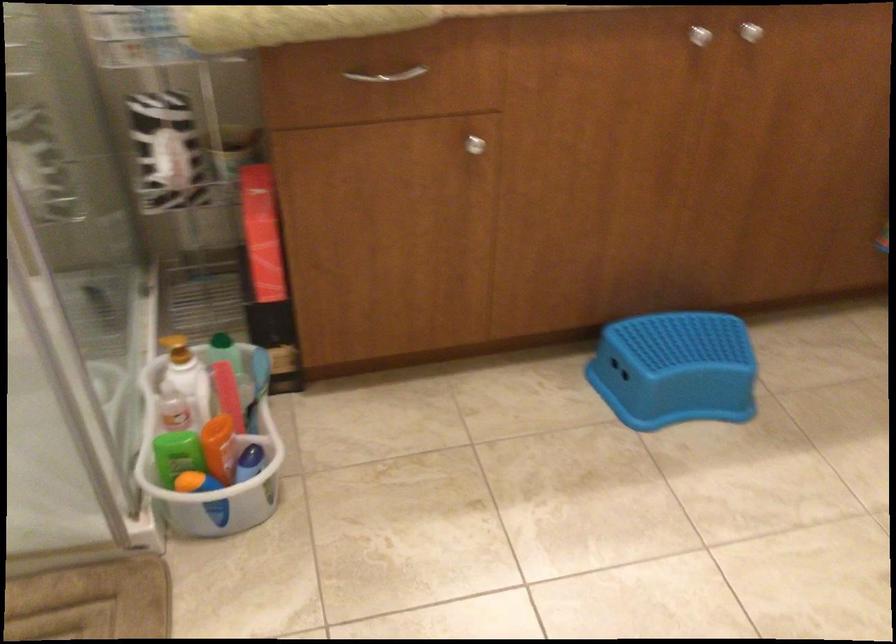
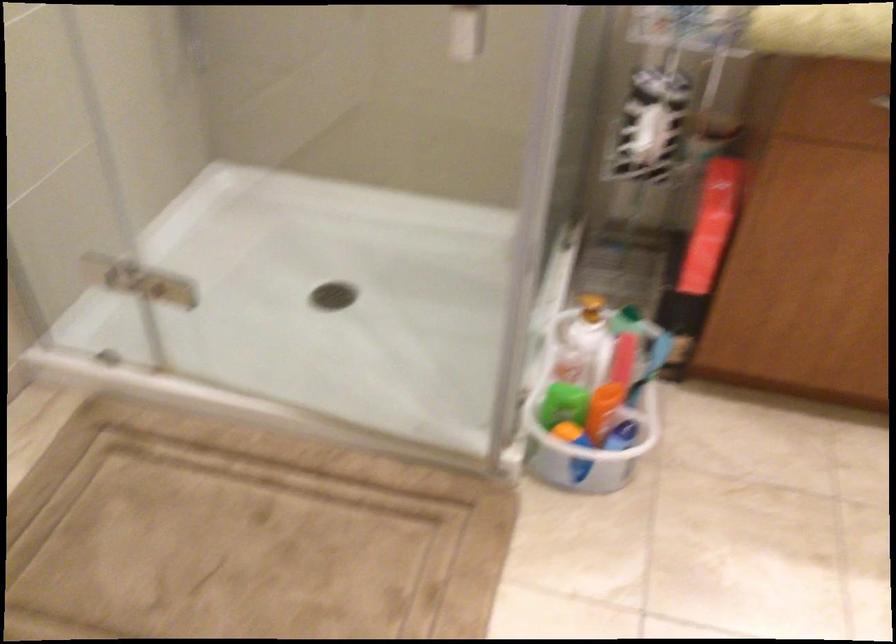
Find the pixel in the second image that matches [205,442] in the first image.

(595, 397)